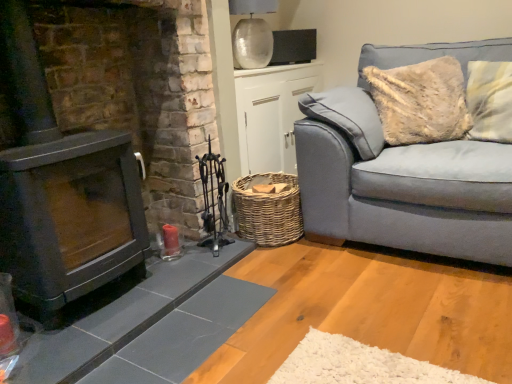
Question: From the image's perspective, is light blue fabric couch at right located beneath woven wicker basket at center?

Choices:
 (A) no
 (B) yes

Answer: (B)

Question: Is light blue fabric couch at right closer to camera compared to woven wicker basket at center?

Choices:
 (A) no
 (B) yes

Answer: (B)

Question: From the image's perspective, would you say light blue fabric couch at right is positioned over woven wicker basket at center?

Choices:
 (A) no
 (B) yes

Answer: (A)

Question: From a real-world perspective, does light blue fabric couch at right stand above woven wicker basket at center?

Choices:
 (A) no
 (B) yes

Answer: (B)

Question: Does light blue fabric couch at right have a smaller size compared to woven wicker basket at center?

Choices:
 (A) yes
 (B) no

Answer: (B)

Question: Considering their positions, is woven wicker basket at center located in front of or behind light blue fabric couch at right?

Choices:
 (A) front
 (B) behind

Answer: (B)

Question: Looking at their shapes, would you say woven wicker basket at center is wider or thinner than light blue fabric couch at right?

Choices:
 (A) wide
 (B) thin

Answer: (B)

Question: From the image's perspective, is woven wicker basket at center located above or below light blue fabric couch at right?

Choices:
 (A) below
 (B) above

Answer: (B)

Question: Considering the positions of woven wicker basket at center and light blue fabric couch at right in the image, is woven wicker basket at center bigger or smaller than light blue fabric couch at right?

Choices:
 (A) small
 (B) big

Answer: (A)

Question: From their relative heights in the image, would you say light blue fabric couch at right is taller or shorter than woven brown basket at lower center?

Choices:
 (A) short
 (B) tall

Answer: (B)

Question: Do you think light blue fabric couch at right is within woven brown basket at lower center, or outside of it?

Choices:
 (A) outside
 (B) inside

Answer: (A)

Question: Does point (487, 46) appear closer or farther from the camera than point (260, 246)?

Choices:
 (A) closer
 (B) farther

Answer: (B)

Question: From a real-world perspective, is light blue fabric couch at right positioned above or below woven brown basket at lower center?

Choices:
 (A) above
 (B) below

Answer: (A)

Question: Is point (240, 235) closer or farther from the camera than point (268, 163)?

Choices:
 (A) farther
 (B) closer

Answer: (B)

Question: Is woven brown basket at lower center situated inside woven wicker basket at center or outside?

Choices:
 (A) outside
 (B) inside

Answer: (A)